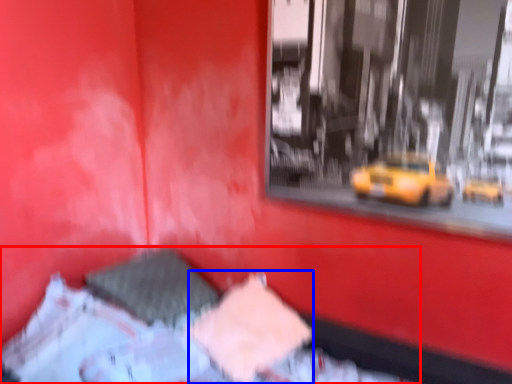
Question: Which object appears closest to the camera in this image, bed (highlighted by a red box) or sheet (highlighted by a blue box)?

Choices:
 (A) bed
 (B) sheet

Answer: (A)